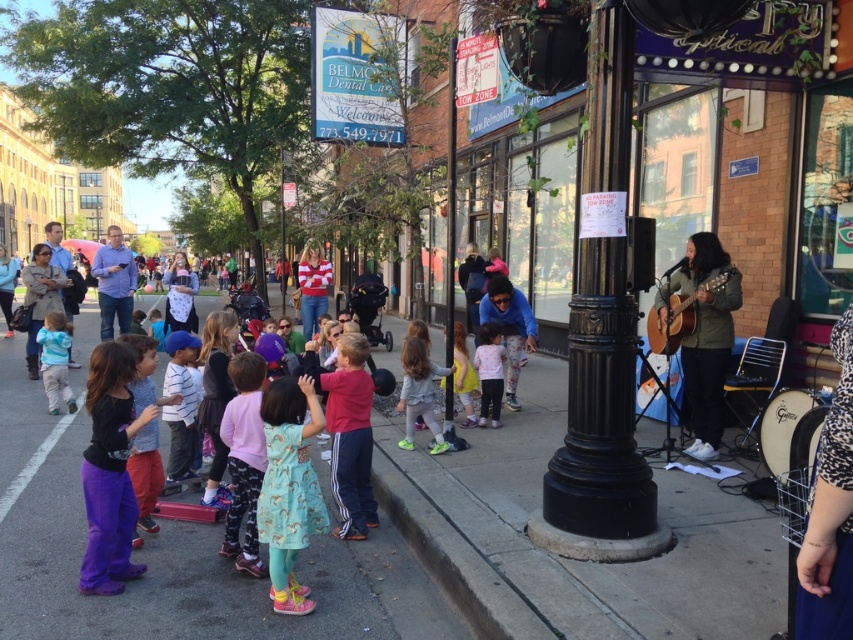
Who is positioned more to the right, green matte jacket at right or floral dress at center?

Positioned to the right is green matte jacket at right.

Which of these two, green matte jacket at right or floral dress at center, stands taller?

green matte jacket at right is taller.

The height and width of the screenshot is (640, 853). What do you see at coordinates (704, 333) in the screenshot? I see `green matte jacket at right` at bounding box center [704, 333].

Where is `green matte jacket at right`? The height and width of the screenshot is (640, 853). green matte jacket at right is located at coordinates (704, 333).

Is acoustic guitar at right to the right of yellow fabric dress at center from the viewer's perspective?

Indeed, acoustic guitar at right is positioned on the right side of yellow fabric dress at center.

Can you confirm if acoustic guitar at right is positioned above yellow fabric dress at center?

Indeed, acoustic guitar at right is positioned over yellow fabric dress at center.

What do you see at coordinates (671, 323) in the screenshot? The height and width of the screenshot is (640, 853). I see `acoustic guitar at right` at bounding box center [671, 323].

Find the location of a particular element. Image resolution: width=853 pixels, height=640 pixels. acoustic guitar at right is located at coordinates (671, 323).

Between point (183, 417) and point (494, 394), which one is positioned behind?

The point (494, 394) is more distant.

Is point (178, 404) closer to camera compared to point (480, 385)?

Yes, it is in front of point (480, 385).

The height and width of the screenshot is (640, 853). Identify the location of striped cotton shirt at center. (180, 404).